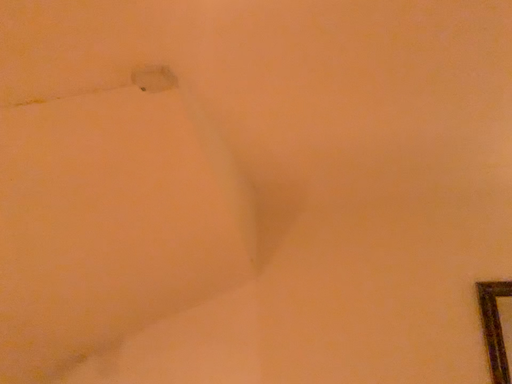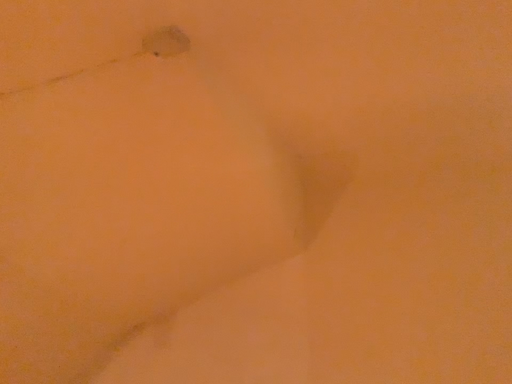
Question: How did the camera likely rotate when shooting the video?

Choices:
 (A) rotated right
 (B) rotated left

Answer: (B)